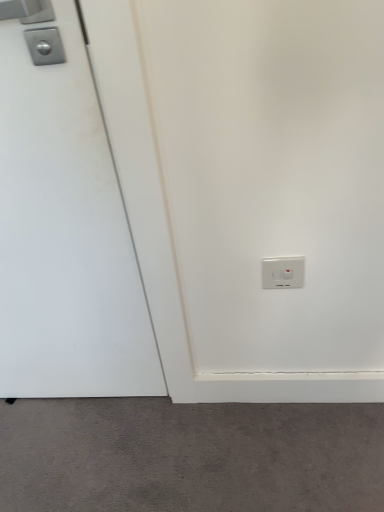
Question: Considering the relative positions of white plastic power plugs and sockets at lower right and white matte door at left in the image provided, is white plastic power plugs and sockets at lower right behind white matte door at left?

Choices:
 (A) no
 (B) yes

Answer: (B)

Question: Is the surface of white plastic power plugs and sockets at lower right in direct contact with white matte door at left?

Choices:
 (A) no
 (B) yes

Answer: (A)

Question: Does white plastic power plugs and sockets at lower right have a lesser width compared to white matte door at left?

Choices:
 (A) yes
 (B) no

Answer: (A)

Question: Is white plastic power plugs and sockets at lower right oriented towards white matte door at left?

Choices:
 (A) no
 (B) yes

Answer: (A)

Question: Can you confirm if white plastic power plugs and sockets at lower right is taller than white matte door at left?

Choices:
 (A) yes
 (B) no

Answer: (B)

Question: From the image's perspective, would you say white plastic power plugs and sockets at lower right is shown under white matte door at left?

Choices:
 (A) yes
 (B) no

Answer: (B)

Question: Can you confirm if white plastic power plugs and sockets at lower right is taller than gray matte carpet at lower center?

Choices:
 (A) no
 (B) yes

Answer: (B)

Question: Considering the relative positions of white plastic power plugs and sockets at lower right and gray matte carpet at lower center in the image provided, is white plastic power plugs and sockets at lower right to the right of gray matte carpet at lower center from the viewer's perspective?

Choices:
 (A) no
 (B) yes

Answer: (B)

Question: Is white plastic power plugs and sockets at lower right to the left of gray matte carpet at lower center from the viewer's perspective?

Choices:
 (A) no
 (B) yes

Answer: (A)

Question: Is white plastic power plugs and sockets at lower right in contact with gray matte carpet at lower center?

Choices:
 (A) no
 (B) yes

Answer: (A)

Question: Considering the relative positions of white plastic power plugs and sockets at lower right and gray matte carpet at lower center in the image provided, is white plastic power plugs and sockets at lower right in front of gray matte carpet at lower center?

Choices:
 (A) yes
 (B) no

Answer: (A)

Question: Is gray matte carpet at lower center a part of white plastic power plugs and sockets at lower right?

Choices:
 (A) yes
 (B) no

Answer: (B)

Question: Is white matte door at left positioned far away from gray matte carpet at lower center?

Choices:
 (A) yes
 (B) no

Answer: (B)